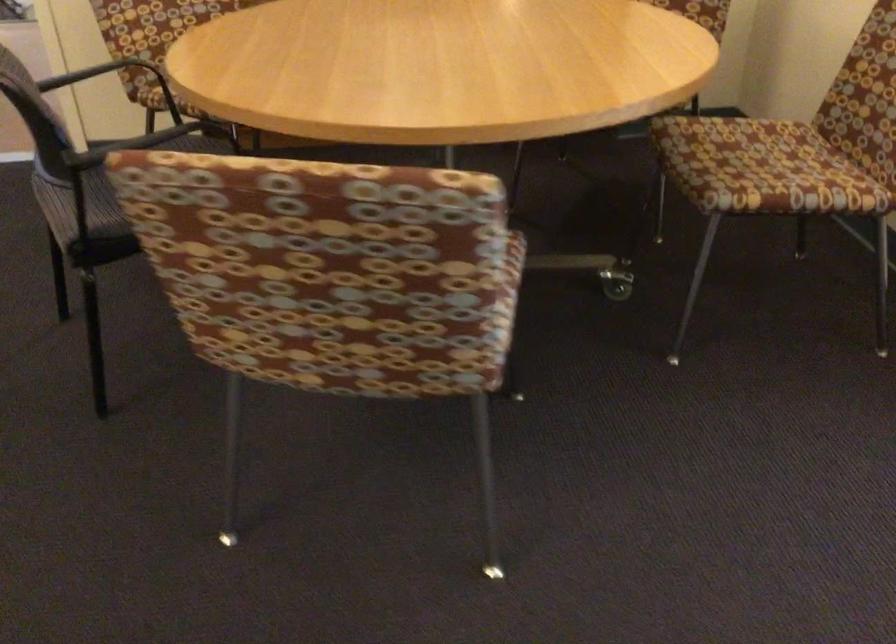
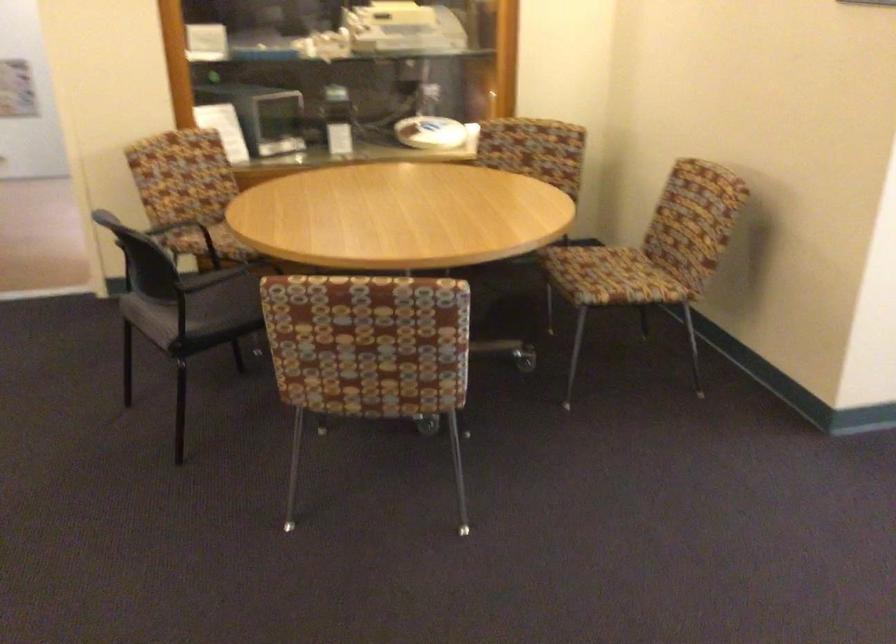
Question: The images are taken continuously from a first-person perspective. In which direction are you moving?

Choices:
 (A) Left
 (B) Right
 (C) Forward
 (D) Backward

Answer: (D)